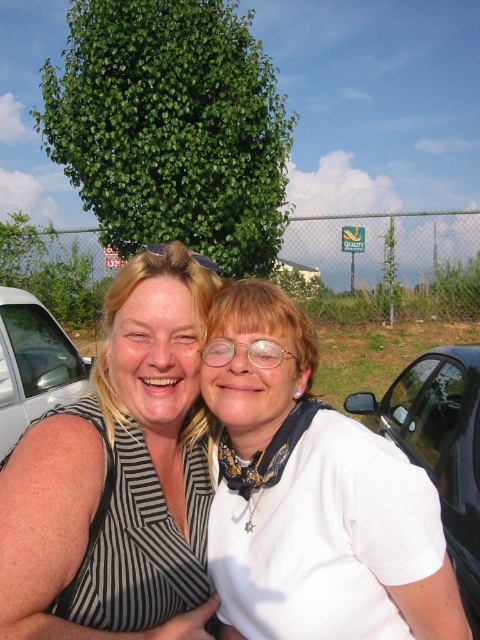
Between white matte shirt at center and white glossy car at left, which one appears on the right side from the viewer's perspective?

white matte shirt at center

Is white matte shirt at center in front of white glossy car at left?

That is True.

Who is more forward, (372, 470) or (2, 364)?

Point (372, 470) is more forward.

Locate an element on the screen. white matte shirt at center is located at coordinates (311, 496).

Based on the photo, can you confirm if black glossy car at right is positioned to the right of white glossy car at left?

Indeed, black glossy car at right is positioned on the right side of white glossy car at left.

Between black glossy car at right and white glossy car at left, which one appears on the left side from the viewer's perspective?

white glossy car at left

Where is `black glossy car at right`? This screenshot has height=640, width=480. black glossy car at right is located at coordinates (440, 445).

Find the location of a particular element. This screenshot has width=480, height=640. black glossy car at right is located at coordinates (440, 445).

Is white matte shirt at center smaller than black glossy car at right?

Correct, white matte shirt at center occupies less space than black glossy car at right.

Which is more to the right, white matte shirt at center or black glossy car at right?

From the viewer's perspective, black glossy car at right appears more on the right side.

Does point (432, 630) come behind point (444, 392)?

No, (432, 630) is closer to viewer.

Where is `white matte shirt at center`? The height and width of the screenshot is (640, 480). white matte shirt at center is located at coordinates (311, 496).